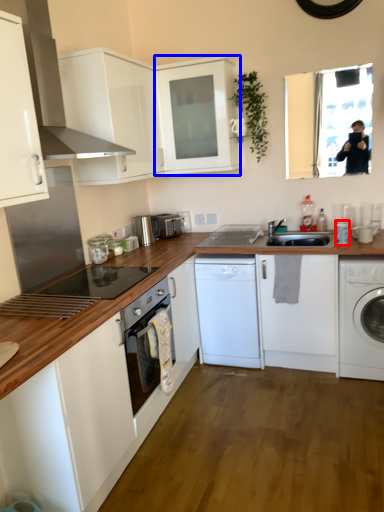
Question: Among these objects, which one is farthest to the camera, appliance (highlighted by a red box) or cabinetry (highlighted by a blue box)?

Choices:
 (A) appliance
 (B) cabinetry

Answer: (A)